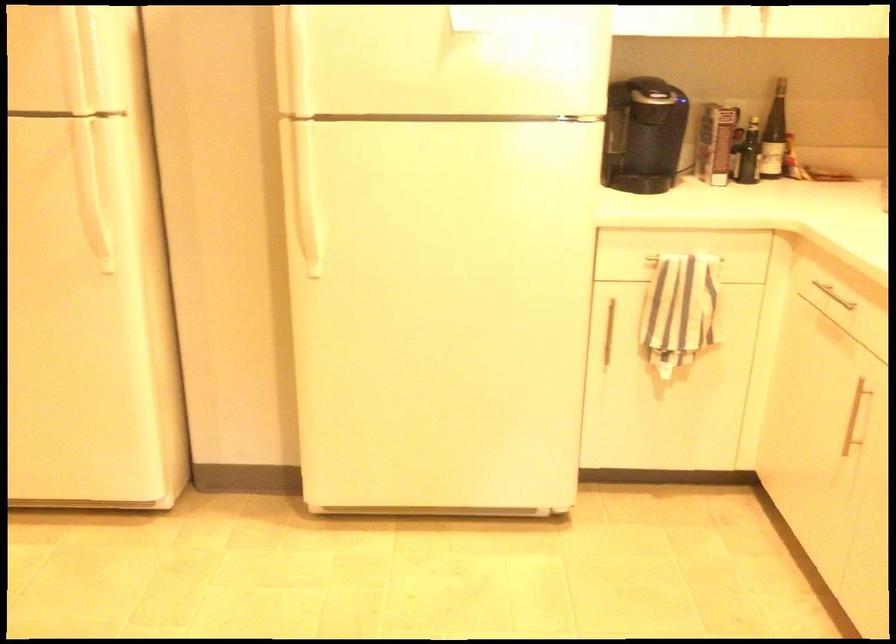
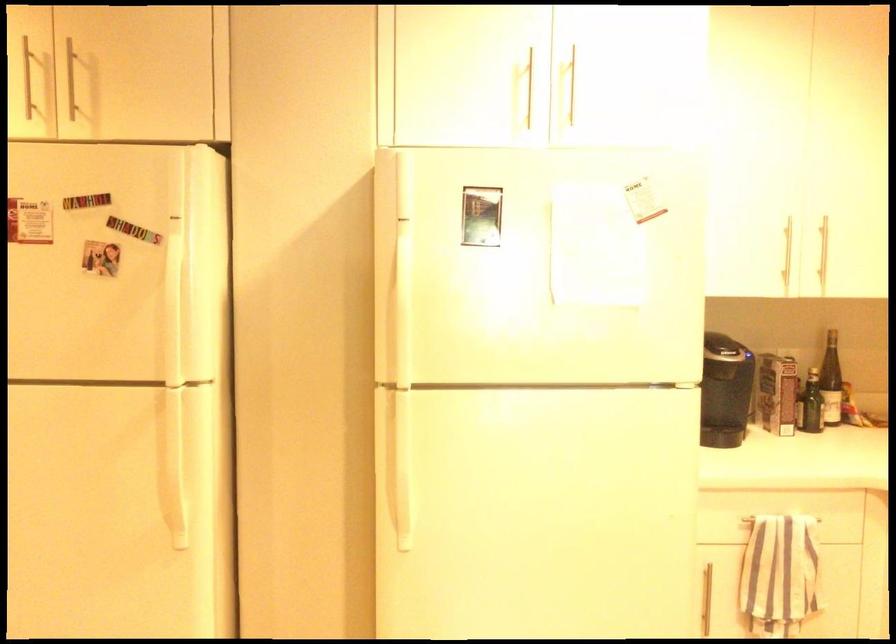
Locate, in the second image, the point that corresponds to pixel 778 135 in the first image.

(831, 381)